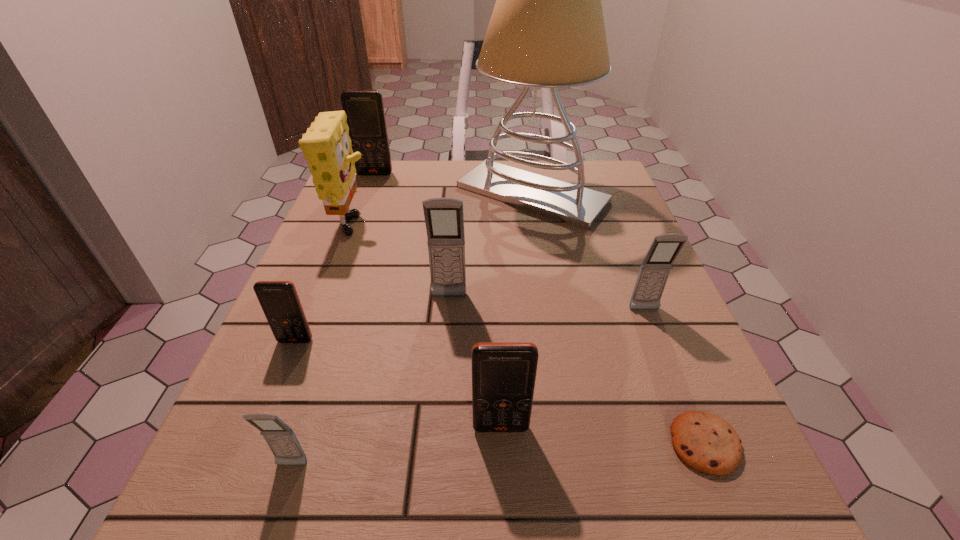
What are the coordinates of `vacant point located 0.180m on the front-facing side of the second farthest gray cellular telephone` in the screenshot? It's located at (680, 400).

Find the location of a particular element. free space located 0.060m on the screen of the fifth farthest cellular telephone is located at coordinates (503, 476).

The width and height of the screenshot is (960, 540). What are the coordinates of `free point located 0.220m on the screen of the third nearest cellular telephone` in the screenshot? It's located at (242, 471).

Locate an element on the screen. Image resolution: width=960 pixels, height=540 pixels. vacant space located on the front-facing side of the nearest gray cellular telephone is located at coordinates (276, 511).

The height and width of the screenshot is (540, 960). In order to click on free point located on the left of the cookie in this screenshot , I will do `click(470, 444)`.

The width and height of the screenshot is (960, 540). I want to click on table lamp situated at the far edge, so click(x=547, y=30).

I want to click on cellular telephone that is at the far edge, so click(365, 113).

Find the location of `sponge that is at the left edge`. sponge that is at the left edge is located at coordinates (326, 145).

Where is `table lamp that is at the right edge`? This screenshot has width=960, height=540. table lamp that is at the right edge is located at coordinates (547, 30).

Locate an element on the screen. cellular telephone at the right edge is located at coordinates (655, 269).